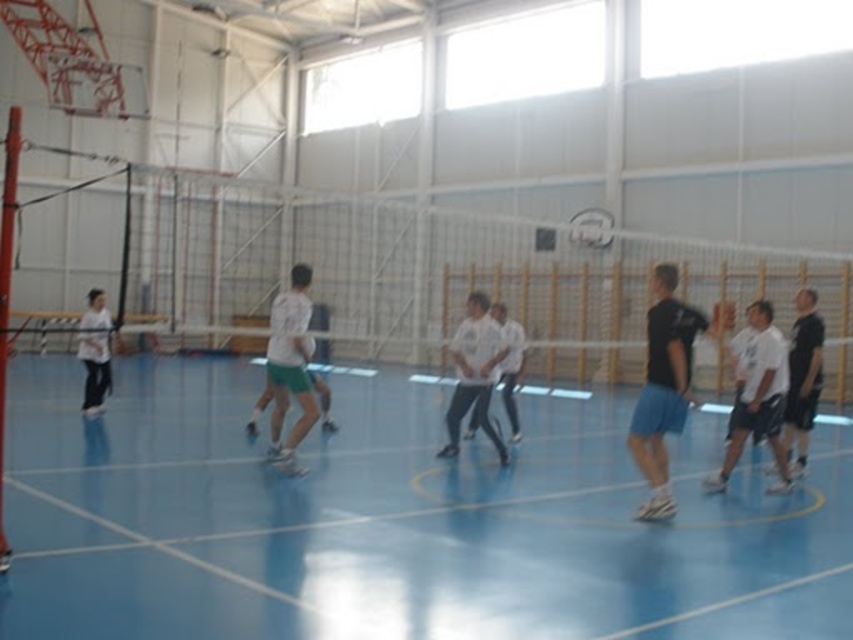
You are a photographer standing behind the net in the gymnasium. You notice two white shirts at the center of the court. Which one is shorter in height between the white matte shirt at center and the white cotton shirt at center?

The white matte shirt at center is shorter in height compared to the white cotton shirt at center.

In the scene shown: You are a basketball player trying to dribble the ball from the blue smooth basketball court at center to the black matte shorts at right. Considering the court and the shorts, which one is closer to the baseline?

→ The blue smooth basketball court at center is shorter than black matte shorts at right, so the court is closer to the baseline than the shorts.